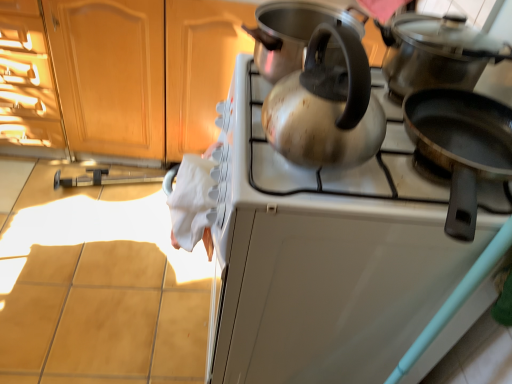
Question: Is the position of satin silver kettle at center less distant than that of black non-stick frying pan at right, the third kitchen appliance positioned from the top?

Choices:
 (A) yes
 (B) no

Answer: (B)

Question: Is satin silver kettle at center directly adjacent to black non-stick frying pan at right, which is counted as the 1th kitchen appliance, starting from the bottom?

Choices:
 (A) yes
 (B) no

Answer: (B)

Question: From a real-world perspective, is satin silver kettle at center positioned under black non-stick frying pan at right, which is counted as the 1th kitchen appliance, starting from the bottom, based on gravity?

Choices:
 (A) no
 (B) yes

Answer: (A)

Question: Considering the relative sizes of satin silver kettle at center and black non-stick frying pan at right, which is counted as the 1th kitchen appliance, starting from the bottom, in the image provided, is satin silver kettle at center smaller than black non-stick frying pan at right, which is counted as the 1th kitchen appliance, starting from the bottom,?

Choices:
 (A) yes
 (B) no

Answer: (A)

Question: From a real-world perspective, does satin silver kettle at center stand above black non-stick frying pan at right, which is counted as the 1th kitchen appliance, starting from the bottom?

Choices:
 (A) no
 (B) yes

Answer: (B)

Question: Is satin silver kettle at center to the right of black non-stick frying pan at right, the third kitchen appliance positioned from the top, from the viewer's perspective?

Choices:
 (A) no
 (B) yes

Answer: (A)

Question: Is wooden cabinet at upper left outside of satin silver kettle at upper center?

Choices:
 (A) no
 (B) yes

Answer: (B)

Question: Is satin silver kettle at upper center a part of wooden cabinet at upper left?

Choices:
 (A) yes
 (B) no

Answer: (B)

Question: From the image's perspective, is wooden cabinet at upper left over satin silver kettle at upper center?

Choices:
 (A) yes
 (B) no

Answer: (A)

Question: Can you confirm if wooden cabinet at upper left is positioned to the right of satin silver kettle at upper center?

Choices:
 (A) yes
 (B) no

Answer: (B)

Question: Considering the relative sizes of wooden cabinet at upper left and satin silver kettle at upper center in the image provided, is wooden cabinet at upper left smaller than satin silver kettle at upper center?

Choices:
 (A) yes
 (B) no

Answer: (B)

Question: From a real-world perspective, does wooden cabinet at upper left stand above satin silver kettle at upper center?

Choices:
 (A) yes
 (B) no

Answer: (A)

Question: Considering the relative sizes of satin silver kettle at upper center and satin silver kettle at center in the image provided, is satin silver kettle at upper center shorter than satin silver kettle at center?

Choices:
 (A) yes
 (B) no

Answer: (B)